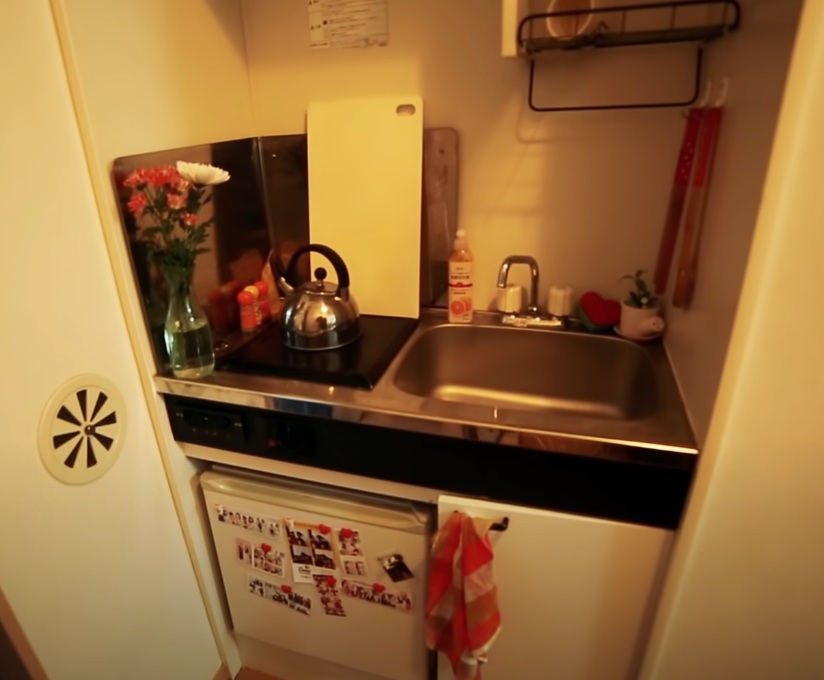
Find the location of `kettle`. kettle is located at coordinates (328, 318).